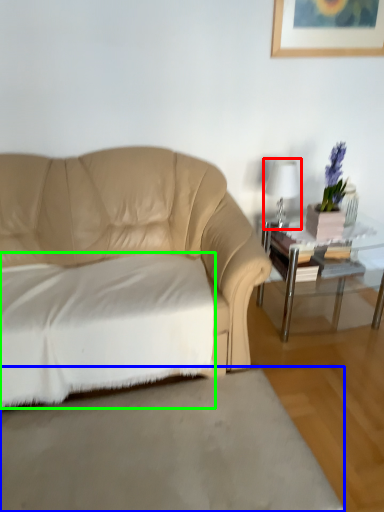
Question: Based on their relative distances, which object is nearer to table lamp (highlighted by a red box)? Choose from concrete (highlighted by a blue box) and sheet (highlighted by a green box).

Choices:
 (A) concrete
 (B) sheet

Answer: (B)